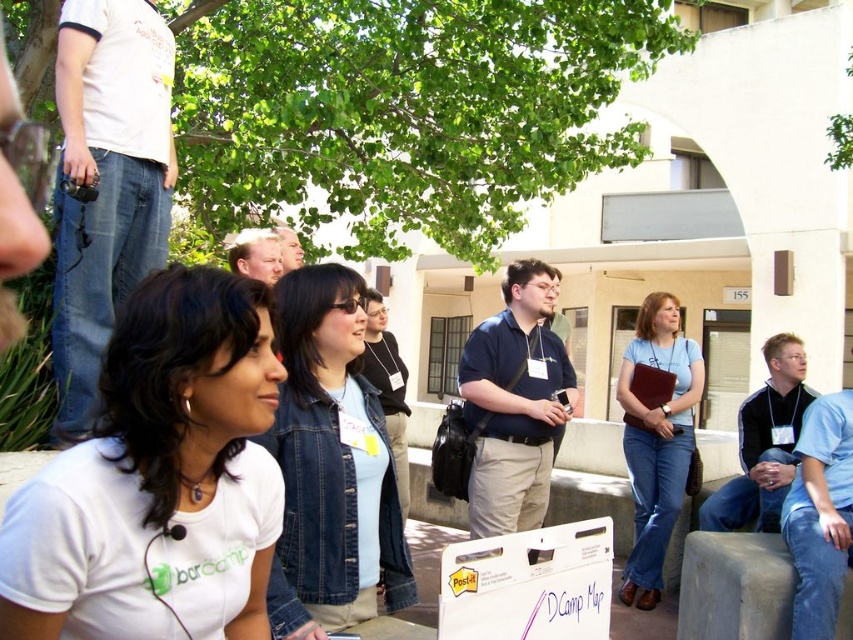
Question: Among these points, which one is farthest from the camera?

Choices:
 (A) (329, 342)
 (B) (280, 516)

Answer: (A)

Question: Does white matte shirt at lower left lie behind denim jacket at center?

Choices:
 (A) no
 (B) yes

Answer: (A)

Question: Does denim jacket at center come behind blue jeans at center?

Choices:
 (A) no
 (B) yes

Answer: (A)

Question: Among these points, which one is nearest to the camera?

Choices:
 (A) (317, 552)
 (B) (181, 433)
 (C) (631, 364)

Answer: (B)

Question: Which point is closer to the camera taking this photo?

Choices:
 (A) (695, 387)
 (B) (161, 456)
 (C) (346, 317)

Answer: (B)

Question: Is denim jacket at center below blue jeans at center?

Choices:
 (A) no
 (B) yes

Answer: (A)